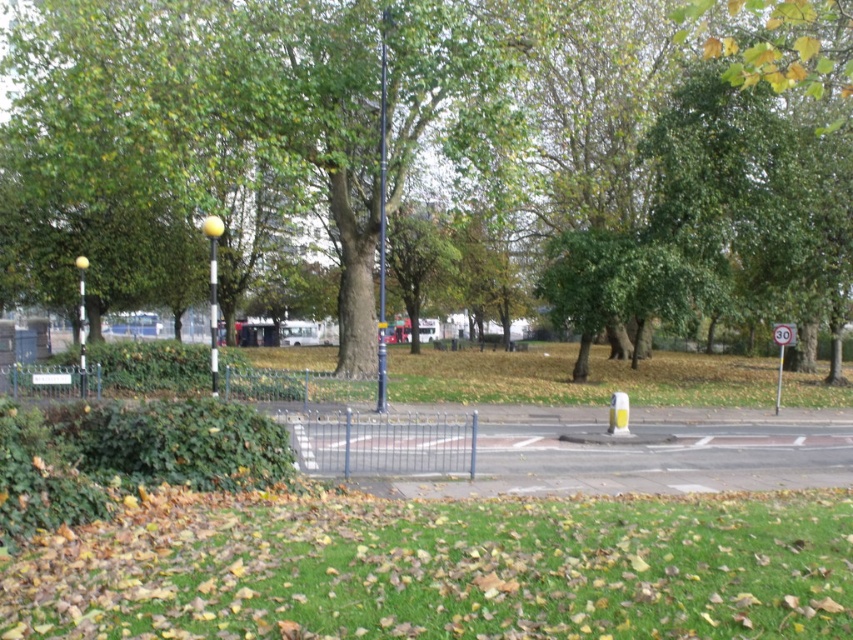
You are standing in the park and want to walk towards the green grass at lower center. However, there is a green leafy tree at center blocking your path. Can you walk around the tree to reach the grass?

The green grass at lower center is behind the green leafy tree at center, so you can walk around the tree to reach the grass since it is positioned behind the tree.

You are planning to place a picnic blanket in the urban park scene. The picnic blanket is 2 meters wide. You want to ensure it fits entirely within the green grass at lower center without overlapping the green leafy tree at center. Is this possible?

The green leafy tree at center is bigger than the green grass at lower center, so the picnic blanket may not fit entirely within the green grass at lower center as the grass area might be smaller than the tree.